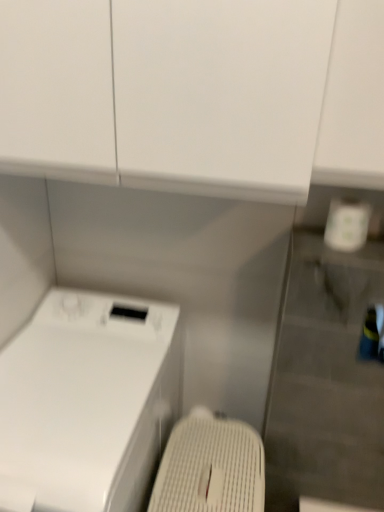
Describe the element at coordinates (210, 468) in the screenshot. I see `white textured washing machine at lower center` at that location.

Locate an element on the screen. white textured washing machine at lower center is located at coordinates (210, 468).

The image size is (384, 512). Describe the element at coordinates (87, 402) in the screenshot. I see `white glossy washing machine at lower left` at that location.

At what (x,y) coordinates should I click in order to perform the action: click on white glossy washing machine at lower left. Please return your answer as a coordinate pair (x, y). This screenshot has height=512, width=384. Looking at the image, I should click on 87,402.

At what (x,y) coordinates should I click in order to perform the action: click on white textured washing machine at lower center. Please return your answer as a coordinate pair (x, y). Looking at the image, I should click on (210, 468).

In the image, is white glossy washing machine at lower left on the left side or the right side of white textured washing machine at lower center?

white glossy washing machine at lower left is positioned on white textured washing machine at lower center's left side.

Is white glossy washing machine at lower left in front of white textured washing machine at lower center?

Yes, white glossy washing machine at lower left is in front of white textured washing machine at lower center.

Does point (48, 376) lie behind point (239, 429)?

No, it is not.

From the image's perspective, is white glossy washing machine at lower left located above white textured washing machine at lower center?

Indeed, from the image's perspective, white glossy washing machine at lower left is shown above white textured washing machine at lower center.

From a real-world perspective, is white glossy washing machine at lower left physically located above or below white textured washing machine at lower center?

From a real-world perspective, white glossy washing machine at lower left is physically above white textured washing machine at lower center.

Between white glossy washing machine at lower left and white textured washing machine at lower center, which one has larger width?

white glossy washing machine at lower left is wider.

Who is shorter, white glossy washing machine at lower left or white textured washing machine at lower center?

white textured washing machine at lower center is shorter.

Which of these two, white glossy washing machine at lower left or white textured washing machine at lower center, is bigger?

white glossy washing machine at lower left.

Would you say white glossy washing machine at lower left is inside or outside white textured washing machine at lower center?

The correct answer is: outside.

Is white glossy washing machine at lower left in contact with white textured washing machine at lower center?

No, white glossy washing machine at lower left is not touching white textured washing machine at lower center.

Is white glossy washing machine at lower left turned away from white textured washing machine at lower center?

No.

Can you tell me how much white glossy washing machine at lower left and white textured washing machine at lower center differ in facing direction?

white glossy washing machine at lower left and white textured washing machine at lower center are facing 0.101 degrees away from each other.

How far apart are white glossy washing machine at lower left and white textured washing machine at lower center?

9.73 inches.

The width and height of the screenshot is (384, 512). What are the coordinates of `home appliance in front of the white textured washing machine at lower center` in the screenshot? It's located at (87, 402).

Between white textured washing machine at lower center and white glossy washing machine at lower left, which one appears on the right side from the viewer's perspective?

From the viewer's perspective, white textured washing machine at lower center appears more on the right side.

Considering their positions, is white textured washing machine at lower center located in front of or behind white glossy washing machine at lower left?

white textured washing machine at lower center is positioned farther from the viewer than white glossy washing machine at lower left.

Which point is more distant from viewer, (x=203, y=431) or (x=42, y=437)?

Positioned behind is point (x=203, y=431).

From the image's perspective, is white textured washing machine at lower center located above white glossy washing machine at lower left?

Actually, white textured washing machine at lower center appears below white glossy washing machine at lower left in the image.

From a real-world perspective, is white textured washing machine at lower center on top of white glossy washing machine at lower left?

No, from a real-world perspective, white textured washing machine at lower center is not over white glossy washing machine at lower left

Looking at their sizes, would you say white textured washing machine at lower center is wider or thinner than white glossy washing machine at lower left?

Considering their sizes, white textured washing machine at lower center looks slimmer than white glossy washing machine at lower left.

Who is taller, white textured washing machine at lower center or white glossy washing machine at lower left?

white glossy washing machine at lower left is taller.

Based on their sizes in the image, would you say white textured washing machine at lower center is bigger or smaller than white glossy washing machine at lower left?

white textured washing machine at lower center is smaller than white glossy washing machine at lower left.

Is white textured washing machine at lower center spatially inside white glossy washing machine at lower left, or outside of it?

white textured washing machine at lower center is not enclosed by white glossy washing machine at lower left.

Are white textured washing machine at lower center and white glossy washing machine at lower left beside each other?

white textured washing machine at lower center is not next to white glossy washing machine at lower left, and they're not touching.

Could you tell me if white textured washing machine at lower center is facing white glossy washing machine at lower left?

No, white textured washing machine at lower center is not aimed at white glossy washing machine at lower left.

What's the angular difference between white textured washing machine at lower center and white glossy washing machine at lower left's facing directions?

There is a 0.101-degree angle between the facing directions of white textured washing machine at lower center and white glossy washing machine at lower left.

How far apart are white textured washing machine at lower center and white glossy washing machine at lower left?

white textured washing machine at lower center and white glossy washing machine at lower left are 9.73 inches apart.

This screenshot has height=512, width=384. I want to click on washing machine below the white glossy washing machine at lower left (from the image's perspective), so click(210, 468).

Where is `washing machine behind the white glossy washing machine at lower left`? The image size is (384, 512). washing machine behind the white glossy washing machine at lower left is located at coordinates (210, 468).

Where is `home appliance above the white textured washing machine at lower center (from the image's perspective)`? This screenshot has width=384, height=512. home appliance above the white textured washing machine at lower center (from the image's perspective) is located at coordinates (87, 402).